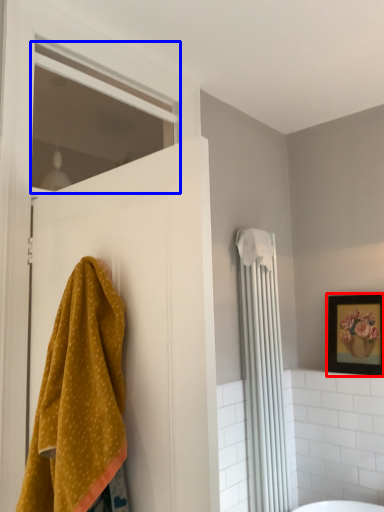
Question: Which object is further to the camera taking this photo, picture frame (highlighted by a red box) or window (highlighted by a blue box)?

Choices:
 (A) picture frame
 (B) window

Answer: (A)